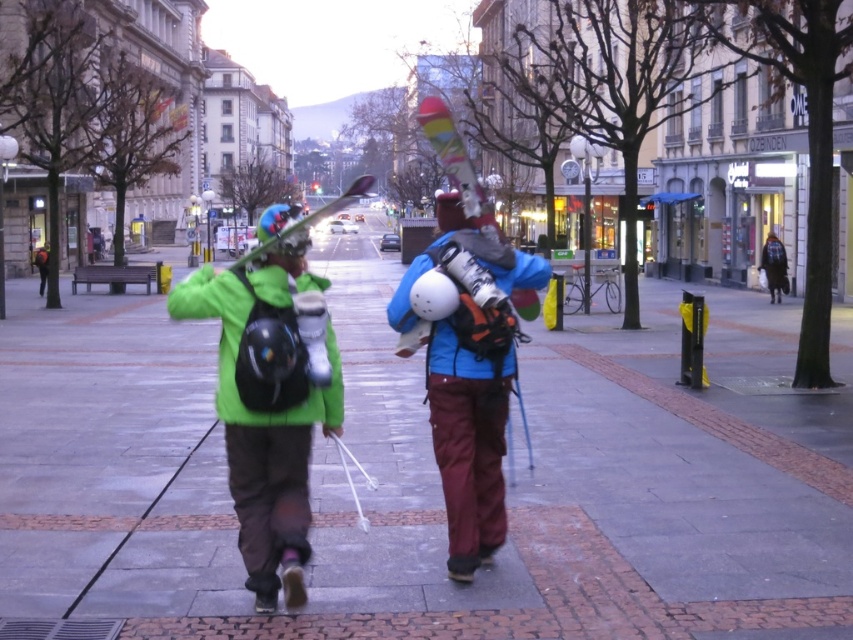
Does point (456, 492) lie behind point (294, 253)?

Yes, it is.

Between matte blue snowboard at center and matte green jacket at center, which one has less height?

Standing shorter between the two is matte blue snowboard at center.

Describe the element at coordinates (466, 369) in the screenshot. This screenshot has width=853, height=640. I see `matte blue snowboard at center` at that location.

In order to click on matte blue snowboard at center in this screenshot , I will do `click(466, 369)`.

Does gray concrete pavement at center lie in front of matte green jacket at center?

That is False.

Does gray concrete pavement at center appear on the left side of matte green jacket at center?

Incorrect, gray concrete pavement at center is not on the left side of matte green jacket at center.

The height and width of the screenshot is (640, 853). I want to click on gray concrete pavement at center, so click(x=430, y=477).

Locate an element on the screen. gray concrete pavement at center is located at coordinates (430, 477).

Who is taller, gray concrete pavement at center or matte green ski at center?

With more height is matte green ski at center.

Locate an element on the screen. The image size is (853, 640). gray concrete pavement at center is located at coordinates (430, 477).

The width and height of the screenshot is (853, 640). What are the coordinates of `gray concrete pavement at center` in the screenshot? It's located at (430, 477).